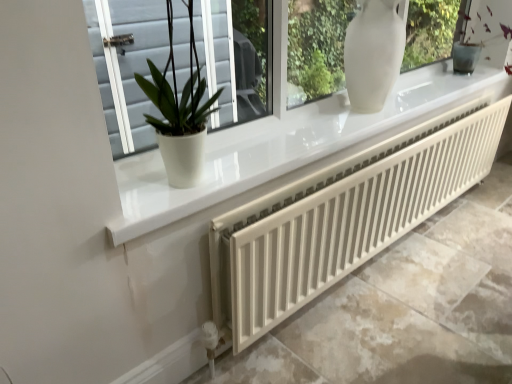
The image size is (512, 384). In order to click on white glossy pot at left in this screenshot , I will do `click(127, 65)`.

Describe the element at coordinates (127, 65) in the screenshot. The height and width of the screenshot is (384, 512). I see `white glossy pot at left` at that location.

The width and height of the screenshot is (512, 384). In order to click on white matte radiator at lower center in this screenshot , I will do `click(342, 217)`.

Describe the element at coordinates (342, 217) in the screenshot. I see `white matte radiator at lower center` at that location.

Find the location of a particular element. white glossy pot at left is located at coordinates (127, 65).

Considering the positions of objects white glossy pot at left and white matte radiator at lower center in the image provided, who is more to the left, white glossy pot at left or white matte radiator at lower center?

white glossy pot at left is more to the left.

Is white glossy pot at left further to camera compared to white matte radiator at lower center?

No, it is not.

Does point (213, 79) come closer to viewer compared to point (388, 187)?

No, it is behind (388, 187).

Based on the photo, from the image's perspective, is white glossy pot at left below white matte radiator at lower center?

Actually, white glossy pot at left appears above white matte radiator at lower center in the image.

From a real-world perspective, between white glossy pot at left and white matte radiator at lower center, who is vertically higher?

In real-world perspective, white glossy pot at left is above.

Can you confirm if white glossy pot at left is wider than white matte radiator at lower center?

Yes.

Between white glossy pot at left and white matte radiator at lower center, which one has more height?

white matte radiator at lower center is taller.

Considering the sizes of objects white glossy pot at left and white matte radiator at lower center in the image provided, who is bigger, white glossy pot at left or white matte radiator at lower center?

Bigger between the two is white matte radiator at lower center.

Is white matte radiator at lower center a part of white glossy pot at left?

No.

Consider the image. Are white glossy pot at left and white matte radiator at lower center far apart?

Yes, white glossy pot at left and white matte radiator at lower center are located far from each other.

Is white matte radiator at lower center at the back of white glossy pot at left?

No, white matte radiator at lower center is not at the back of white glossy pot at left.

Can you tell me how much white glossy pot at left and white matte radiator at lower center differ in facing direction?

There is a 0.433-degree angle between the facing directions of white glossy pot at left and white matte radiator at lower center.

How much distance is there between white glossy pot at left and white matte radiator at lower center?

A distance of 3.92 feet exists between white glossy pot at left and white matte radiator at lower center.

This screenshot has width=512, height=384. Identify the location of radiator below the white glossy pot at left (from a real-world perspective). (342, 217).

Consider the image. Is white matte radiator at lower center to the left or to the right of white glossy pot at left in the image?

In the image, white matte radiator at lower center appears on the right side of white glossy pot at left.

Is white matte radiator at lower center in front of white glossy pot at left?

No, white matte radiator at lower center is behind white glossy pot at left.

Is point (273, 291) closer to camera compared to point (146, 137)?

Yes, point (273, 291) is in front of point (146, 137).

From the image's perspective, is white matte radiator at lower center beneath white glossy pot at left?

Yes, from the image's perspective, white matte radiator at lower center is beneath white glossy pot at left.

From a real-world perspective, is white matte radiator at lower center positioned above or below white glossy pot at left?

white matte radiator at lower center is situated lower than white glossy pot at left in the real world.

Does white matte radiator at lower center have a greater width compared to white glossy pot at left?

Incorrect, the width of white matte radiator at lower center does not surpass that of white glossy pot at left.

Which of these two, white matte radiator at lower center or white glossy pot at left, stands shorter?

Standing shorter between the two is white glossy pot at left.

Between white matte radiator at lower center and white glossy pot at left, which one has larger size?

white matte radiator at lower center.

Would you say white matte radiator at lower center is inside or outside white glossy pot at left?

The correct answer is: outside.

Is there a large distance between white matte radiator at lower center and white glossy pot at left?

white matte radiator at lower center is far away from white glossy pot at left.

Could you tell me if white matte radiator at lower center is facing white glossy pot at left?

No, white matte radiator at lower center does not turn towards white glossy pot at left.

What's the angular difference between white matte radiator at lower center and white glossy pot at left's facing directions?

The angular difference between white matte radiator at lower center and white glossy pot at left is 0.433 degrees.

Identify the location of window above the white matte radiator at lower center (from a real-world perspective). The height and width of the screenshot is (384, 512). (127, 65).

Locate an element on the screen. radiator below the white glossy pot at left (from a real-world perspective) is located at coordinates (342, 217).

This screenshot has height=384, width=512. In order to click on radiator behind the white glossy pot at left in this screenshot , I will do `click(342, 217)`.